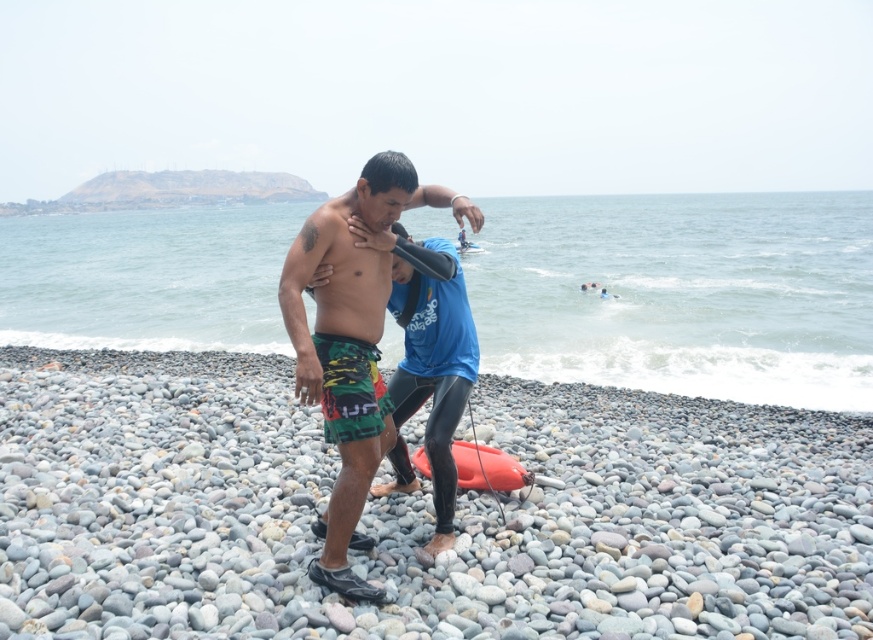
In the scene shown: Does rubber matte surfboard at center appear on the left side of blue rubber wetsuit at center?

Yes, rubber matte surfboard at center is to the left of blue rubber wetsuit at center.

Between point (461, 461) and point (462, 234), which one is positioned behind?

Point (462, 234)

Does point (459, 486) come behind point (469, 243)?

No.

In order to click on rubber matte surfboard at center in this screenshot , I will do `click(487, 467)`.

Is smooth pebble at center below blue rubber wetsuit at center?

Indeed, smooth pebble at center is positioned under blue rubber wetsuit at center.

Is point (102, 561) positioned behind point (461, 232)?

No.

In order to click on smooth pebble at center in this screenshot , I will do `click(418, 513)`.

Identify the location of smooth pebble at center. (418, 513).

Is green patterned shorts at center smaller than rubber matte surfboard at center?

No, green patterned shorts at center is not smaller than rubber matte surfboard at center.

What are the coordinates of `green patterned shorts at center` in the screenshot? It's located at (348, 346).